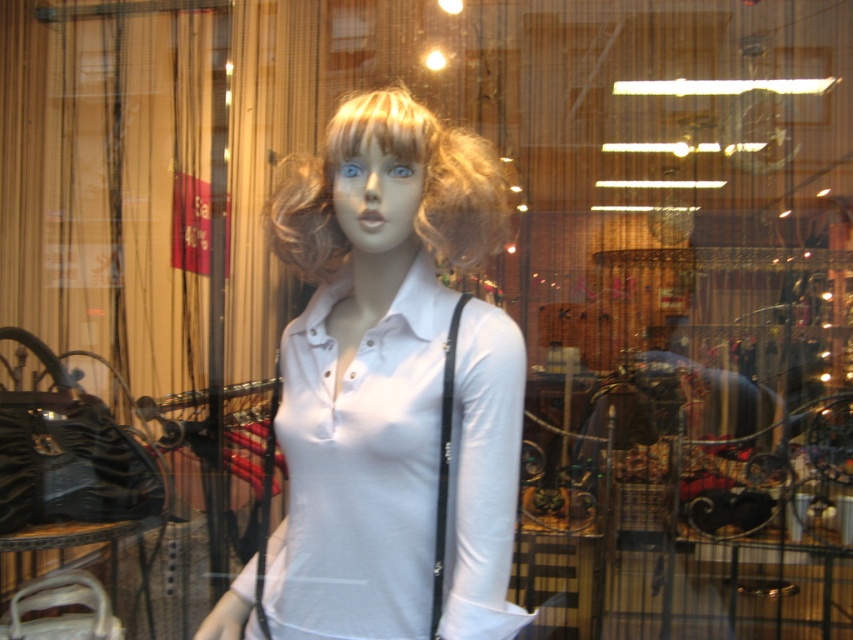
You are a customer looking at the store window display. You notice the white matte shirt at center and the blondehair at center. Which one is wider?

The white matte shirt at center is wider than the blondehair at center.

You are standing in front of the store window and want to touch the mannequin displayed inside. The store window is made of thick glass. If your hand can reach up to 1 meter, can you reach the point at coordinates point (328, 580) where the mannequin is located?

The distance between point (328, 580) and the camera is 1.05 meters, so your hand can only reach up to 1 meter, which is shorter than the required distance. Therefore, you cannot reach the point at coordinates point (328, 580) where the mannequin is located.

You are a window cleaner who needs to clean the store window where the mannequin is displayed. You have a 6 inch long cleaning tool. If you need to reach both the white matte shirt at center and the blondehair at center, can your tool reach both objects from your current position outside the window?

The white matte shirt at center is 6.32 inches away from blondehair at center. Since your tool is only 6 inches long, it cannot reach both objects as the distance between them exceeds the tool length.